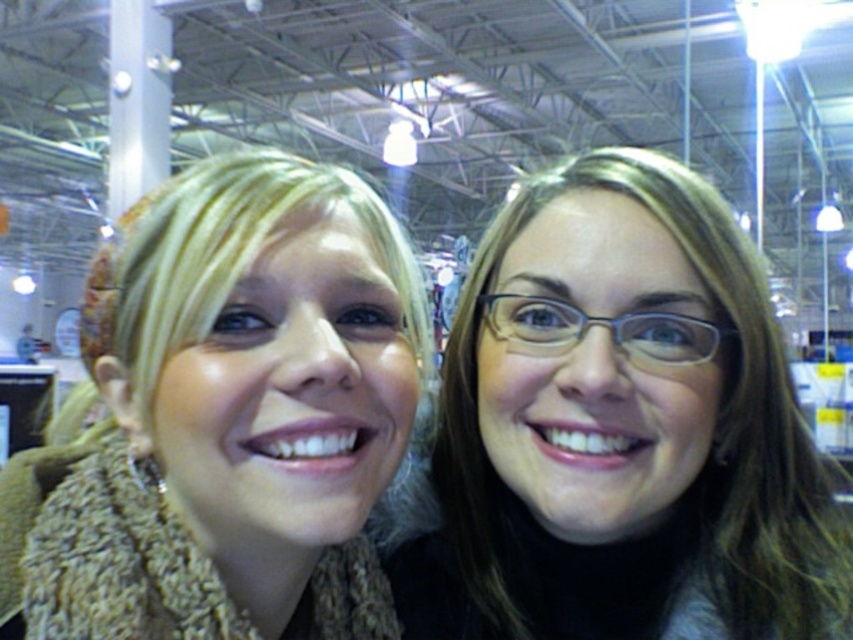
Question: Among these objects, which one is nearest to the camera?

Choices:
 (A) knitted beige scarf at left
 (B) matte black glasses at upper right

Answer: (A)

Question: Can you confirm if matte black glasses at upper right is positioned to the left of knitted beige scarf at left?

Choices:
 (A) yes
 (B) no

Answer: (B)

Question: Is matte black glasses at upper right behind knitted beige scarf at left?

Choices:
 (A) no
 (B) yes

Answer: (B)

Question: Can you confirm if matte black glasses at upper right is positioned to the right of knitted beige scarf at left?

Choices:
 (A) no
 (B) yes

Answer: (B)

Question: Which object appears closest to the camera in this image?

Choices:
 (A) knitted beige scarf at left
 (B) matte black glasses at upper right

Answer: (A)